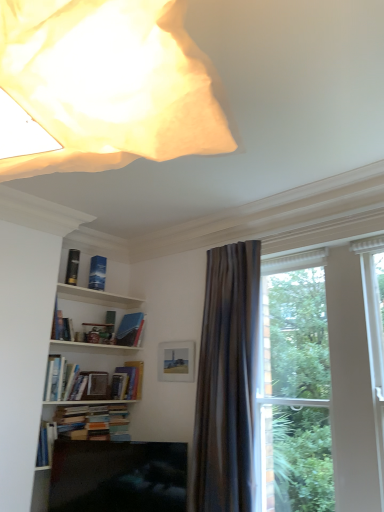
Where is `free region on the left part of blue matte bookshelf at upper left, positioned as the 2th book in top-to-bottom order`? The image size is (384, 512). free region on the left part of blue matte bookshelf at upper left, positioned as the 2th book in top-to-bottom order is located at coordinates (77, 290).